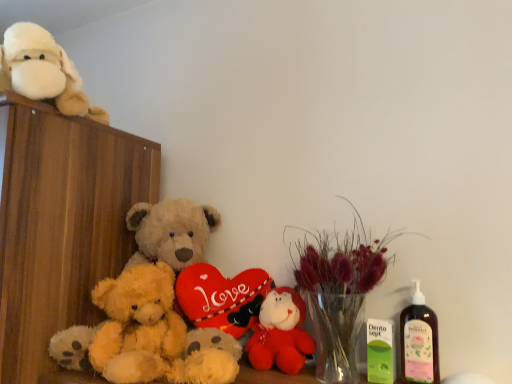
In order to face velvet red plush toy at center, should I rotate leftwards or rightwards?

To face it directly, rotate right by 2.992 degrees.

I want to click on pink plastic bottle at right, so click(x=419, y=341).

How much space does fluffy beige teddy bear at center, positioned as the second teddy bear in bottom-to-top order, occupy horizontally?

28.90 centimeters.

What do you see at coordinates (339, 290) in the screenshot? I see `translucent glass vase at center` at bounding box center [339, 290].

Locate an element on the screen. This screenshot has width=512, height=384. fluffy yellow teddy bear at center, which is the 3th teddy bear in top-to-bottom order is located at coordinates (150, 333).

I want to click on velvet red plush toy at center, so click(280, 333).

Is translucent glass vase at center with fluffy beige teddy bear at center, which appears as the 2th teddy bear when viewed from the top?

No, translucent glass vase at center is not beside fluffy beige teddy bear at center, which appears as the 2th teddy bear when viewed from the top.

Does translucent glass vase at center lie behind fluffy beige teddy bear at center, which appears as the 2th teddy bear when viewed from the top?

No, it is not.

In the scene shown: Could you tell me if translucent glass vase at center is turned towards fluffy beige teddy bear at center, positioned as the second teddy bear in bottom-to-top order?

No, translucent glass vase at center is not aimed at fluffy beige teddy bear at center, positioned as the second teddy bear in bottom-to-top order.

At what (x,y) coordinates should I click in order to perform the action: click on floral arrangement that appears on the right of fluffy beige teddy bear at center, which appears as the 2th teddy bear when viewed from the top. Please return your answer as a coordinate pair (x, y). This screenshot has width=512, height=384. Looking at the image, I should click on (339, 290).

Does velvet red plush toy at center contain wooden cabinet at left?

No.

Considering the sizes of velvet red plush toy at center and wooden cabinet at left in the image, is velvet red plush toy at center wider or thinner than wooden cabinet at left?

In the image, velvet red plush toy at center appears to be more narrow than wooden cabinet at left.

From the image's perspective, who appears lower, velvet red plush toy at center or wooden cabinet at left?

velvet red plush toy at center, from the image's perspective.

From the image's perspective, is wooden cabinet at left positioned above or below fluffy beige teddy bear at center, which appears as the 2th teddy bear when viewed from the top?

wooden cabinet at left is situated lower than fluffy beige teddy bear at center, which appears as the 2th teddy bear when viewed from the top, in the image.

Consider the image. Is wooden cabinet at left spatially inside fluffy beige teddy bear at center, positioned as the second teddy bear in bottom-to-top order, or outside of it?

The correct answer is: outside.

Between wooden cabinet at left and fluffy beige teddy bear at center, which appears as the 2th teddy bear when viewed from the top, which one is positioned behind?

fluffy beige teddy bear at center, which appears as the 2th teddy bear when viewed from the top, is behind.

Does wooden cabinet at left have a larger size compared to fluffy beige teddy bear at center, positioned as the second teddy bear in bottom-to-top order?

Yes.

The height and width of the screenshot is (384, 512). In order to click on floral arrangement located above the fluffy yellow teddy bear at center, which is the 3th teddy bear in top-to-bottom order (from a real-world perspective) in this screenshot , I will do `click(339, 290)`.

Could you measure the distance between fluffy yellow teddy bear at center, the 1th teddy bear positioned from the bottom, and translucent glass vase at center?

A distance of 13.32 inches exists between fluffy yellow teddy bear at center, the 1th teddy bear positioned from the bottom, and translucent glass vase at center.

Is there a large distance between fluffy yellow teddy bear at center, the 1th teddy bear positioned from the bottom, and translucent glass vase at center?

Actually, fluffy yellow teddy bear at center, the 1th teddy bear positioned from the bottom, and translucent glass vase at center are a little close together.

Is fluffy yellow teddy bear at center, which is the 3th teddy bear in top-to-bottom order, bigger than translucent glass vase at center?

Actually, fluffy yellow teddy bear at center, which is the 3th teddy bear in top-to-bottom order, might be smaller than translucent glass vase at center.

Which is in front, translucent glass vase at center or white plush toy at upper left, marked as the 1th teddy bear in a top-to-bottom arrangement?

translucent glass vase at center.

Can you tell me how much translucent glass vase at center and white plush toy at upper left, marked as the 1th teddy bear in a top-to-bottom arrangement, differ in facing direction?

The facing directions of translucent glass vase at center and white plush toy at upper left, marked as the 1th teddy bear in a top-to-bottom arrangement, are 0.00135 degrees apart.

Does translucent glass vase at center have a greater height compared to white plush toy at upper left, marked as the 1th teddy bear in a top-to-bottom arrangement?

Indeed, translucent glass vase at center has a greater height compared to white plush toy at upper left, marked as the 1th teddy bear in a top-to-bottom arrangement.

Is translucent glass vase at center oriented away from white plush toy at upper left, marked as the 3th teddy bear in a bottom-to-top arrangement?

No, translucent glass vase at center's orientation is not away from white plush toy at upper left, marked as the 3th teddy bear in a bottom-to-top arrangement.

In terms of height, does wooden cabinet at left look taller or shorter compared to translucent glass vase at center?

wooden cabinet at left is taller than translucent glass vase at center.

Looking at this image, is translucent glass vase at center located within wooden cabinet at left?

No, translucent glass vase at center is located outside of wooden cabinet at left.

Visually, is wooden cabinet at left positioned to the left or to the right of translucent glass vase at center?

Based on their positions, wooden cabinet at left is located to the left of translucent glass vase at center.

Is wooden cabinet at left facing towards translucent glass vase at center?

No, wooden cabinet at left does not turn towards translucent glass vase at center.

How many degrees apart are the facing directions of fluffy beige teddy bear at center, positioned as the second teddy bear in bottom-to-top order, and pink plastic bottle at right?

The facing directions of fluffy beige teddy bear at center, positioned as the second teddy bear in bottom-to-top order, and pink plastic bottle at right are 38.9 degrees apart.

From the image's perspective, between fluffy beige teddy bear at center, which appears as the 2th teddy bear when viewed from the top, and pink plastic bottle at right, who is located below?

From the image's view, pink plastic bottle at right is below.

In order to click on bottle below the fluffy beige teddy bear at center, which appears as the 2th teddy bear when viewed from the top (from the image's perspective) in this screenshot , I will do `click(419, 341)`.

Identify the location of the 1st teddy bear counting from the left side of the translucent glass vase at center. (172, 232).

Locate an element on the screen. The height and width of the screenshot is (384, 512). toy below the wooden cabinet at left (from a real-world perspective) is located at coordinates (280, 333).

When comparing their distances from translucent glass vase at center, does pink plastic bottle at right or fluffy beige teddy bear at center, positioned as the second teddy bear in bottom-to-top order, seem closer?

pink plastic bottle at right is positioned closer to the anchor translucent glass vase at center.

Which object lies further to the anchor point translucent glass vase at center, wooden cabinet at left or fluffy beige teddy bear at center, which appears as the 2th teddy bear when viewed from the top?

wooden cabinet at left is positioned further to the anchor translucent glass vase at center.

Considering their positions, is wooden cabinet at left positioned further to fluffy beige teddy bear at center, which appears as the 2th teddy bear when viewed from the top, than pink plastic bottle at right?

Among the two, pink plastic bottle at right is located further to fluffy beige teddy bear at center, which appears as the 2th teddy bear when viewed from the top.

When comparing their distances from velvet red plush toy at center, does translucent glass vase at center or fluffy beige teddy bear at center, which appears as the 2th teddy bear when viewed from the top, seem further?

fluffy beige teddy bear at center, which appears as the 2th teddy bear when viewed from the top.

When comparing their distances from velvet red plush toy at center, does fluffy yellow teddy bear at center, the 1th teddy bear positioned from the bottom, or wooden cabinet at left seem closer?

Among the two, fluffy yellow teddy bear at center, the 1th teddy bear positioned from the bottom, is located nearer to velvet red plush toy at center.

Based on the photo, when comparing their distances from fluffy yellow teddy bear at center, the 1th teddy bear positioned from the bottom, does wooden cabinet at left or translucent glass vase at center seem closer?

wooden cabinet at left.

Estimate the real-world distances between objects in this image. Which object is further from fluffy yellow teddy bear at center, the 1th teddy bear positioned from the bottom, wooden cabinet at left or white plush toy at upper left, marked as the 1th teddy bear in a top-to-bottom arrangement?

The object further to fluffy yellow teddy bear at center, the 1th teddy bear positioned from the bottom, is white plush toy at upper left, marked as the 1th teddy bear in a top-to-bottom arrangement.

From the picture: Which object lies nearer to the anchor point white plush toy at upper left, marked as the 3th teddy bear in a bottom-to-top arrangement, velvet red plush toy at center or wooden cabinet at left?

wooden cabinet at left.

Identify the location of floral arrangement between velvet red plush toy at center and pink plastic bottle at right in the horizontal direction. (339, 290).

At what (x,y) coordinates should I click in order to perform the action: click on shelf between white plush toy at upper left, marked as the 1th teddy bear in a top-to-bottom arrangement, and fluffy yellow teddy bear at center, the 1th teddy bear positioned from the bottom, from top to bottom. Please return your answer as a coordinate pair (x, y). The width and height of the screenshot is (512, 384). Looking at the image, I should click on (61, 224).

I want to click on teddy bear located between fluffy yellow teddy bear at center, which is the 3th teddy bear in top-to-bottom order, and velvet red plush toy at center in the left-right direction, so click(x=172, y=232).

Where is `teddy bear between fluffy yellow teddy bear at center, the 1th teddy bear positioned from the bottom, and pink plastic bottle at right from left to right`? This screenshot has height=384, width=512. teddy bear between fluffy yellow teddy bear at center, the 1th teddy bear positioned from the bottom, and pink plastic bottle at right from left to right is located at coordinates (172, 232).